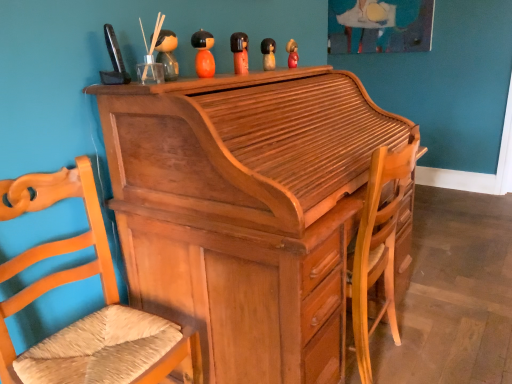
Question: Can you confirm if orange matte wooden doll at upper center, the 2th toy when ordered from left to right, is shorter than matte orange doll at upper center, positioned as the third toy in left-to-right order?

Choices:
 (A) yes
 (B) no

Answer: (B)

Question: Could you tell me if orange matte wooden doll at upper center, the 2th toy when ordered from left to right, is facing matte orange doll at upper center, marked as the 3th toy in a front-to-back arrangement?

Choices:
 (A) yes
 (B) no

Answer: (B)

Question: Are orange matte wooden doll at upper center, positioned as the fourth toy in right-to-left order, and matte orange doll at upper center, the 3th toy when ordered from back to front, beside each other?

Choices:
 (A) no
 (B) yes

Answer: (A)

Question: From the image's perspective, does orange matte wooden doll at upper center, positioned as the fourth toy in right-to-left order, appear higher than matte orange doll at upper center, positioned as the third toy in left-to-right order?

Choices:
 (A) no
 (B) yes

Answer: (A)

Question: Is orange matte wooden doll at upper center, positioned as the fourth toy in right-to-left order, positioned beyond the bounds of matte orange doll at upper center, placed as the 3th toy when sorted from right to left?

Choices:
 (A) yes
 (B) no

Answer: (A)

Question: Relative to matte wooden figurine at upper center, arranged as the fifth toy when viewed from the front, is wooden woven seat at left in front or behind?

Choices:
 (A) front
 (B) behind

Answer: (A)

Question: Is point click(78, 192) closer or farther from the camera than point click(294, 49)?

Choices:
 (A) farther
 (B) closer

Answer: (B)

Question: From a real-world perspective, is wooden woven seat at left positioned above or below matte wooden figurine at upper center, the 5th toy from the left?

Choices:
 (A) above
 (B) below

Answer: (B)

Question: From the image's perspective, is wooden woven seat at left positioned above or below matte wooden figurine at upper center, which ranks as the 1th toy in back-to-front order?

Choices:
 (A) below
 (B) above

Answer: (A)

Question: In terms of width, does light brown wood desk at center look wider or thinner when compared to matte wooden figurine at upper center, positioned as the first toy in front-to-back order?

Choices:
 (A) thin
 (B) wide

Answer: (B)

Question: Considering their positions, is light brown wood desk at center located in front of or behind matte wooden figurine at upper center, positioned as the first toy in front-to-back order?

Choices:
 (A) behind
 (B) front

Answer: (B)

Question: In terms of size, does light brown wood desk at center appear bigger or smaller than matte wooden figurine at upper center, which appears as the 5th toy when viewed from the back?

Choices:
 (A) small
 (B) big

Answer: (B)

Question: Do you think light brown wood desk at center is within matte wooden figurine at upper center, positioned as the first toy in front-to-back order, or outside of it?

Choices:
 (A) inside
 (B) outside

Answer: (B)

Question: Is light brown wood desk at center to the left or to the right of wooden woven seat at left in the image?

Choices:
 (A) right
 (B) left

Answer: (A)

Question: Is light brown wood desk at center inside the boundaries of wooden woven seat at left, or outside?

Choices:
 (A) outside
 (B) inside

Answer: (A)